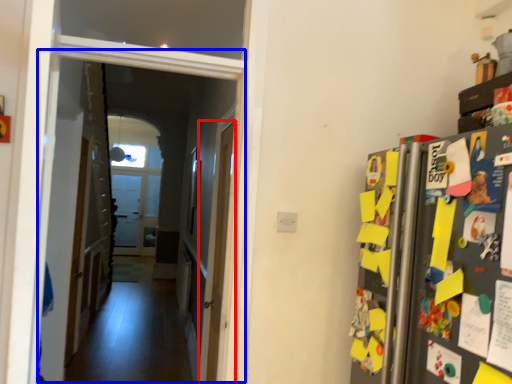
Question: Which of the following is the closest to the observer, door (highlighted by a red box) or corridor (highlighted by a blue box)?

Choices:
 (A) door
 (B) corridor

Answer: (B)